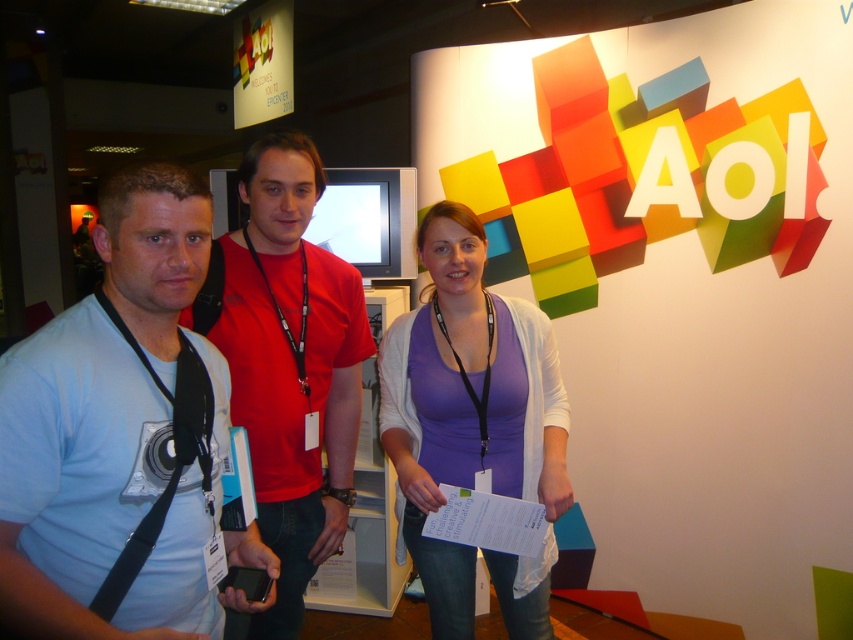
Question: Is matte blue shirt at left thinner than red cotton t-shirt at center?

Choices:
 (A) no
 (B) yes

Answer: (B)

Question: Which point is farther from the camera taking this photo?

Choices:
 (A) (244, 426)
 (B) (190, 202)
 (C) (413, 484)

Answer: (C)

Question: Can you confirm if matte blue shirt at left is bigger than red cotton t-shirt at center?

Choices:
 (A) no
 (B) yes

Answer: (A)

Question: Which object is closer to the camera taking this photo?

Choices:
 (A) purple matte shirt at center
 (B) matte blue shirt at left

Answer: (B)

Question: Is matte blue shirt at left smaller than purple matte shirt at center?

Choices:
 (A) yes
 (B) no

Answer: (A)

Question: Which object is the farthest from the red cotton t-shirt at center?

Choices:
 (A) purple matte shirt at center
 (B) matte blue shirt at left

Answer: (B)